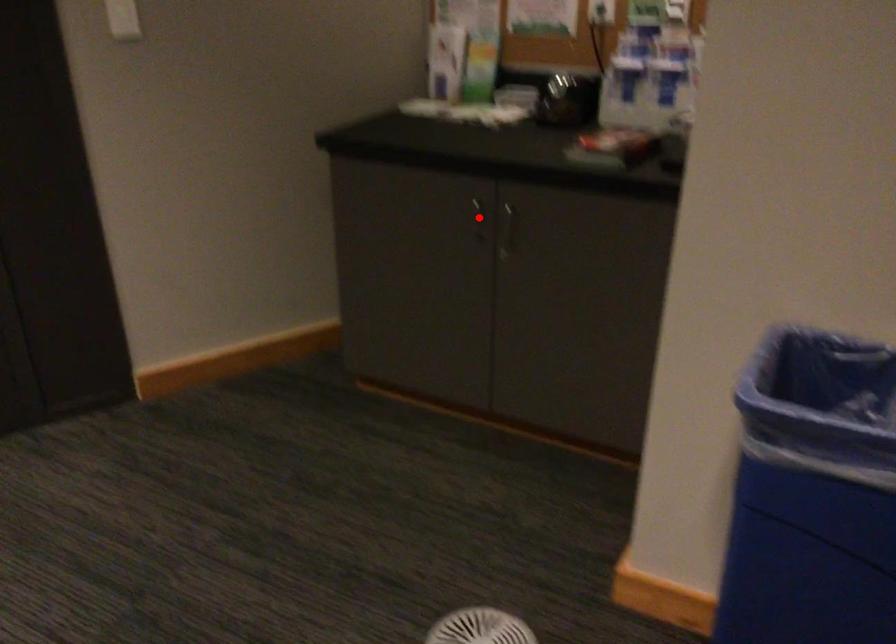
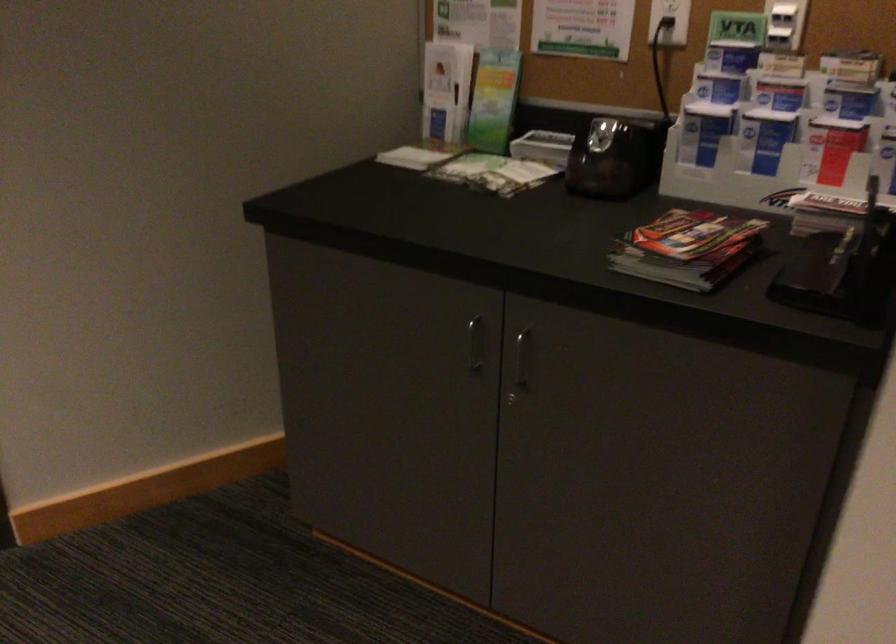
Locate, in the second image, the point that corresponds to the highlighted location in the first image.

(475, 343)